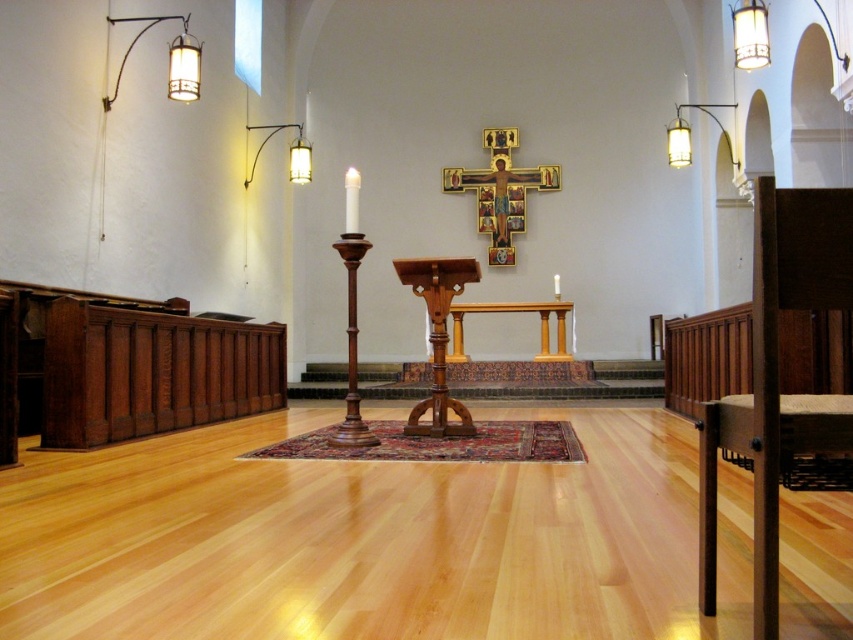
Question: Which is farther from the wooden altar at center?

Choices:
 (A) metallic wall sconce at upper left
 (B) metallic wall-mounted light fixture at upper left
 (C) wooden pulpit at center

Answer: (B)

Question: Is metallic wall-mounted light fixture at upper left to the right of wooden altar at center from the viewer's perspective?

Choices:
 (A) yes
 (B) no

Answer: (B)

Question: Can you confirm if wooden pulpit at center is wider than wooden altar at center?

Choices:
 (A) yes
 (B) no

Answer: (B)

Question: Considering the real-world distances, which object is closest to the metallic wall-mounted light fixture at upper left?

Choices:
 (A) metallic wall sconce at upper left
 (B) wooden pulpit at center
 (C) wooden altar at center

Answer: (A)

Question: Is metallic wall-mounted light fixture at upper left wider than metallic wall sconce at upper left?

Choices:
 (A) no
 (B) yes

Answer: (B)

Question: Which of the following is the farthest from the observer?

Choices:
 (A) (305, 145)
 (B) (438, 332)

Answer: (A)